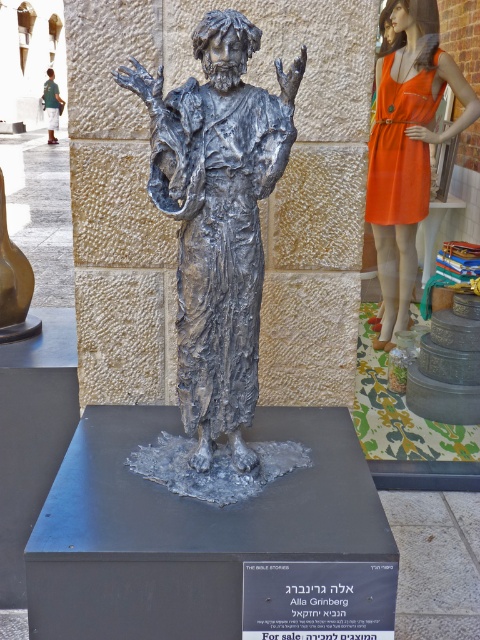
Question: Can you confirm if shiny silver statue at center is thinner than green fabric dress at upper left?

Choices:
 (A) yes
 (B) no

Answer: (B)

Question: Does orange fabric dress at upper right have a greater width compared to green fabric dress at upper left?

Choices:
 (A) no
 (B) yes

Answer: (B)

Question: Considering the real-world distances, which object is farthest from the green fabric dress at upper left?

Choices:
 (A) shiny silver statue at center
 (B) orange fabric dress at upper right

Answer: (A)

Question: Which point appears farthest from the camera in this image?

Choices:
 (A) (406, 51)
 (B) (204, 211)
 (C) (54, 122)

Answer: (C)

Question: Among these objects, which one is farthest from the camera?

Choices:
 (A) orange fabric dress at upper right
 (B) green fabric dress at upper left
 (C) shiny silver statue at center

Answer: (B)

Question: Does orange fabric dress at upper right have a larger size compared to green fabric dress at upper left?

Choices:
 (A) no
 (B) yes

Answer: (B)